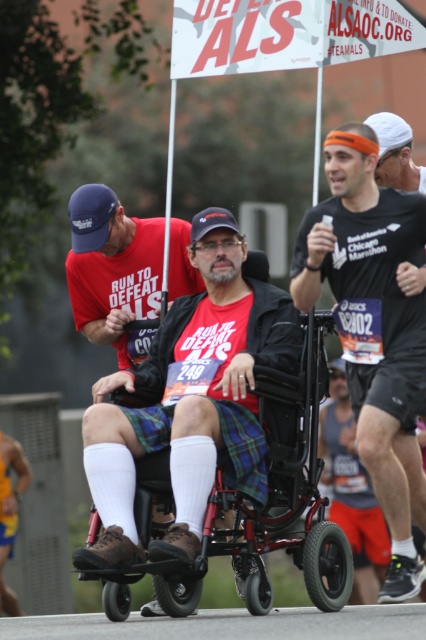
You are a photographer at the charity run event. You want to capture a photo where both the matte black shirt at center and the metallic red wheelchair at center are clearly visible. Given their sizes, which object should you focus on to ensure both are in frame without cropping?

The matte black shirt at center is narrower than the metallic red wheelchair at center. To ensure both are in frame, focus on the metallic red wheelchair at center since it is wider and will require more space, automatically including the narrower matte black shirt at center.

Based on the scene description, can you determine if the matte black shirt at center is covering part of the metallic red wheelchair at center?

The matte black shirt at center is positioned over metallic red wheelchair at center, so yes, it is covering part of it.

You are a photographer at the charity run event. You want to capture a photo of the matte black shirt at center and metallic red wheelchair at center together in the frame. The minimum distance required for your camera to focus both subjects clearly is 1.2 meters. Can you take the photo without moving either subject?

The distance between the matte black shirt at center and metallic red wheelchair at center is 1.08 meters, which is less than the camera requirement of 1.2 meters. Therefore, you cannot take the photo without moving either subject.